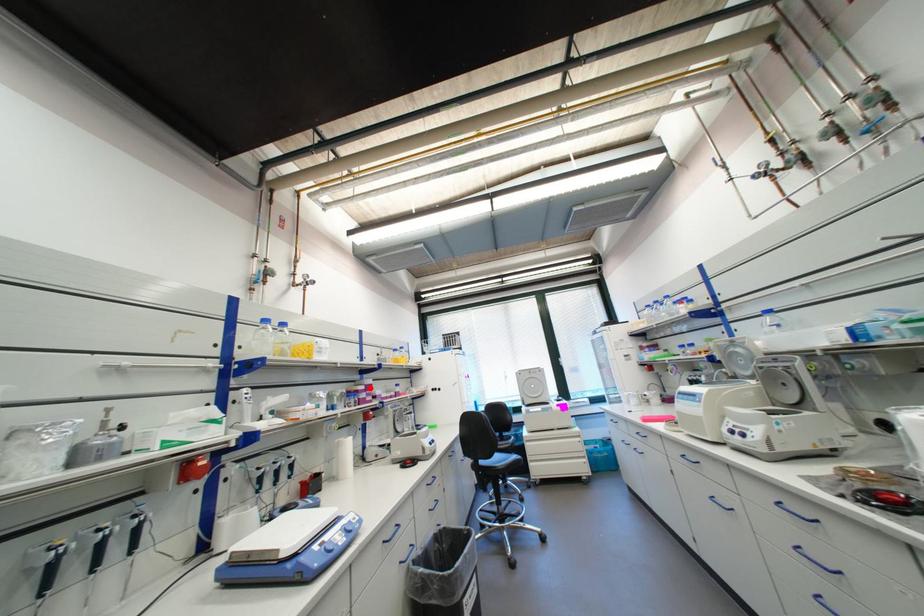
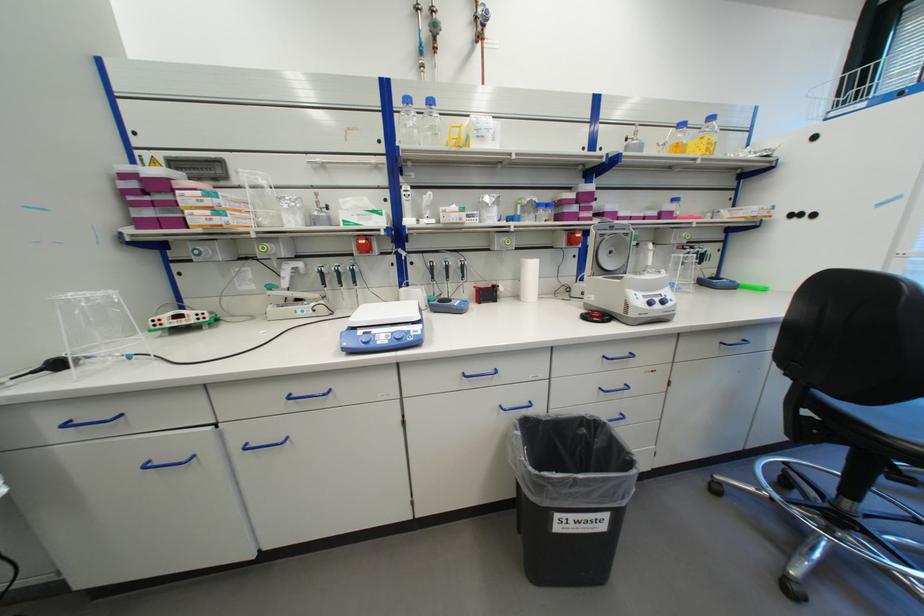
Locate, in the second image, the point that corresponds to the highlighted location in the first image.

(579, 197)